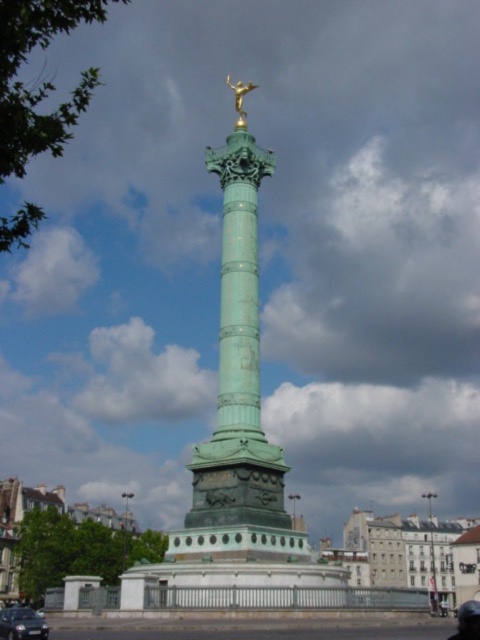
You are a tourist standing in front of the green patina column at center and want to take a photo of it without any obstructions. Is the shiny black sedan at lower left blocking your view?

The shiny black sedan at lower left is behind the green patina column at center, so it is not blocking your view. You can take the photo without any obstructions.

You are standing in front of the Colonne de Juillet in Paris. You notice two points marked on the monument. One is at coordinate point (36, 612) and the other at point (252, 88). Which point is closer to you?

Point (36, 612) is closer to the viewer than point (252, 88).